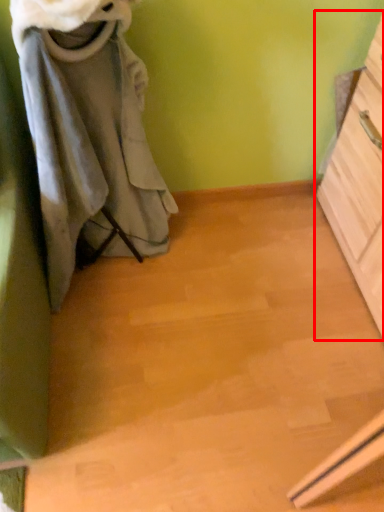
Question: Considering the relative positions of chest of drawers (annotated by the red box) and laundry in the image provided, where is chest of drawers (annotated by the red box) located with respect to the staircase?

Choices:
 (A) right
 (B) left

Answer: (A)